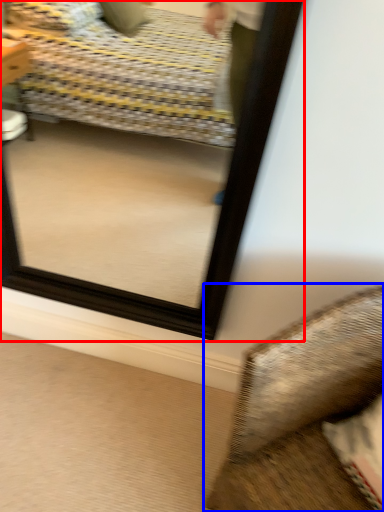
Question: Which object appears closest to the camera in this image, mirror (highlighted by a red box) or furniture (highlighted by a blue box)?

Choices:
 (A) mirror
 (B) furniture

Answer: (B)